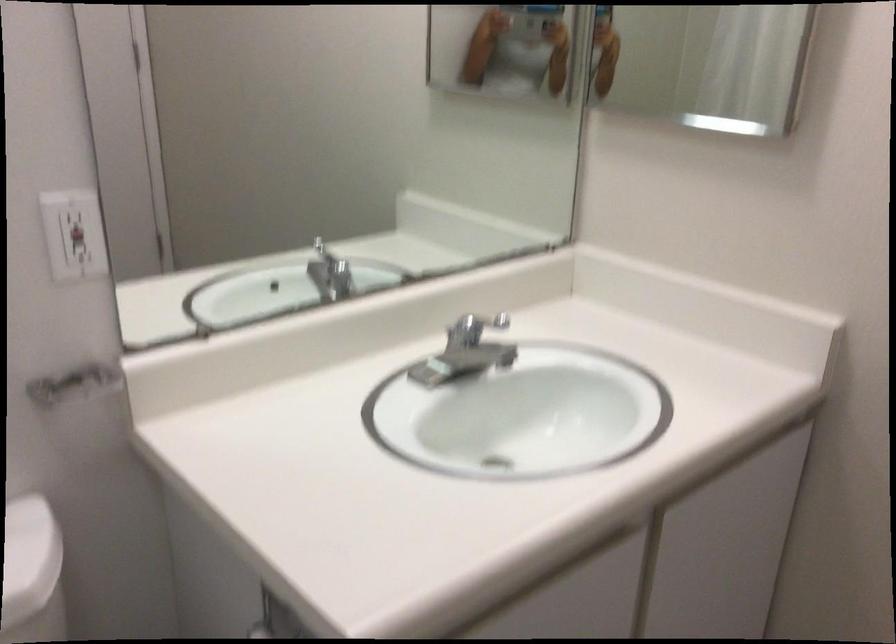
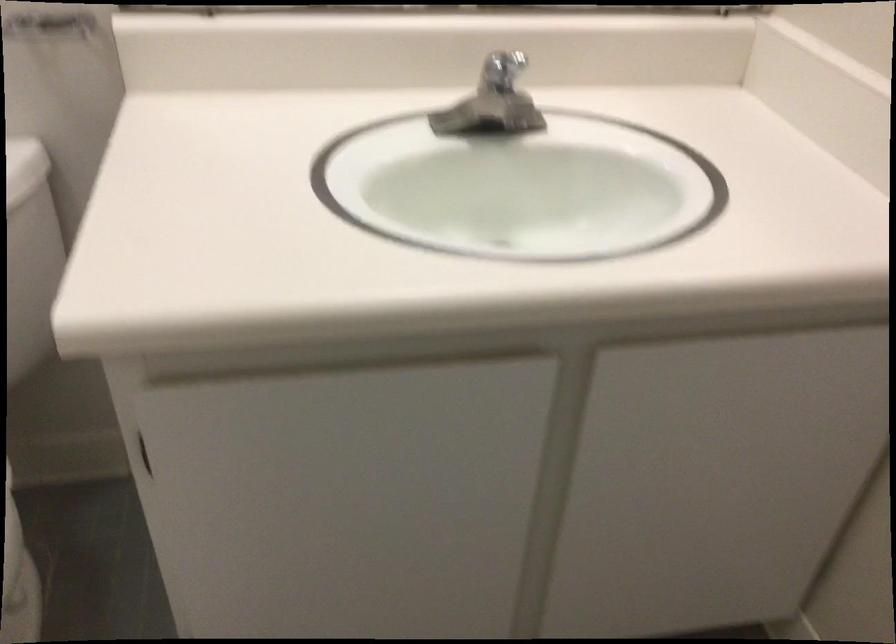
Question: I am providing you with two images of the same scene from different viewpoints. Which of the following objects are not visible in image2?

Choices:
 (A) medicine cabinet handle
 (B) cabinet door pull
 (C) faucet handle
 (D) purple cleaning bottle

Answer: (A)